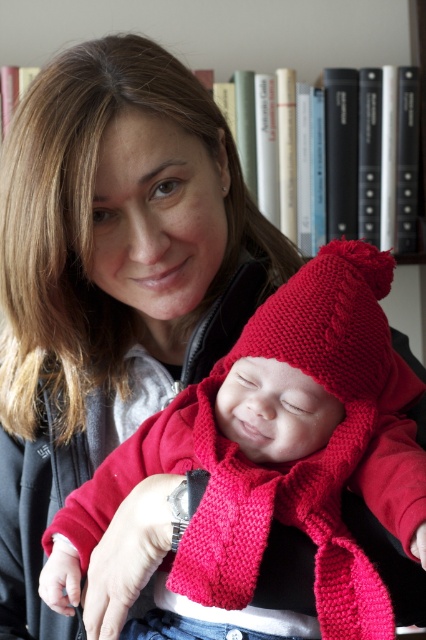
Question: Which object is farther from the camera taking this photo?

Choices:
 (A) knitted red hat at center
 (B) hardcover books at upper center

Answer: (B)

Question: Which object appears farthest from the camera in this image?

Choices:
 (A) knitted red hat at center
 (B) hardcover books at upper center

Answer: (B)

Question: Considering the relative positions of knitted red hat at center and hardcover books at upper center in the image provided, where is knitted red hat at center located with respect to hardcover books at upper center?

Choices:
 (A) right
 (B) left

Answer: (A)

Question: Which object appears farthest from the camera in this image?

Choices:
 (A) hardcover books at upper center
 (B) knitted red hat at center

Answer: (A)

Question: Does knitted red hat at center appear on the left side of hardcover books at upper center?

Choices:
 (A) yes
 (B) no

Answer: (B)

Question: Can you confirm if knitted red hat at center is positioned above hardcover books at upper center?

Choices:
 (A) yes
 (B) no

Answer: (B)